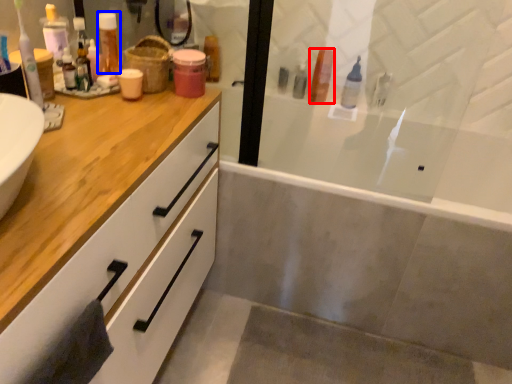
Question: Which of the following is the farthest to the observer, toiletry (highlighted by a red box) or toiletry (highlighted by a blue box)?

Choices:
 (A) toiletry
 (B) toiletry

Answer: (A)